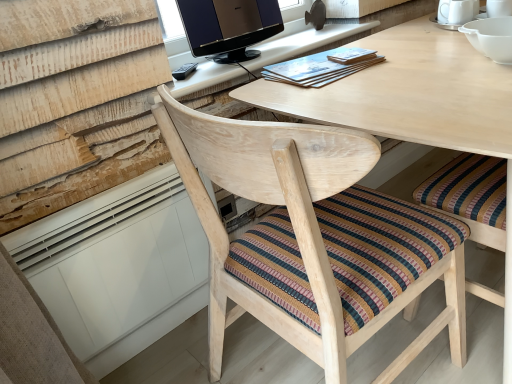
Question: Is natural wood chair at center smaller than matte wooden book at upper center, the 1th book when ordered from left to right?

Choices:
 (A) no
 (B) yes

Answer: (A)

Question: Does natural wood chair at center come behind matte wooden book at upper center, the 1th book when ordered from left to right?

Choices:
 (A) yes
 (B) no

Answer: (B)

Question: Is natural wood chair at center positioned before matte wooden book at upper center, the 2th book in the right-to-left sequence?

Choices:
 (A) no
 (B) yes

Answer: (B)

Question: From the image's perspective, would you say natural wood chair at center is shown under matte wooden book at upper center, the 2th book in the right-to-left sequence?

Choices:
 (A) yes
 (B) no

Answer: (A)

Question: Can matte wooden book at upper center, the 2th book in the right-to-left sequence, be found inside natural wood chair at center?

Choices:
 (A) yes
 (B) no

Answer: (B)

Question: Considering their positions, is light wood computer desk at upper center located in front of or behind matte brown book at upper center, the 2th book from the left?

Choices:
 (A) front
 (B) behind

Answer: (A)

Question: In terms of size, does light wood computer desk at upper center appear bigger or smaller than matte brown book at upper center, the 2th book from the left?

Choices:
 (A) small
 (B) big

Answer: (B)

Question: From the image's perspective, relative to matte brown book at upper center, the 2th book from the left, is light wood computer desk at upper center above or below?

Choices:
 (A) above
 (B) below

Answer: (A)

Question: Based on their positions, is light wood computer desk at upper center located to the left or right of matte brown book at upper center, the first book positioned from the right?

Choices:
 (A) left
 (B) right

Answer: (A)

Question: Considering the positions of natural wood chair at center and matte brown book at upper center, the 2th book from the left, in the image, is natural wood chair at center bigger or smaller than matte brown book at upper center, the 2th book from the left,?

Choices:
 (A) small
 (B) big

Answer: (B)

Question: Considering the positions of point (194, 119) and point (343, 48), is point (194, 119) closer or farther from the camera than point (343, 48)?

Choices:
 (A) farther
 (B) closer

Answer: (B)

Question: From the image's perspective, is natural wood chair at center above or below matte brown book at upper center, the 2th book from the left?

Choices:
 (A) above
 (B) below

Answer: (B)

Question: From a real-world perspective, is natural wood chair at center physically located above or below matte brown book at upper center, the 2th book from the left?

Choices:
 (A) below
 (B) above

Answer: (A)

Question: Would you say matte brown book at upper center, the first book positioned from the right, is to the left or to the right of light wood computer desk at upper center in the picture?

Choices:
 (A) right
 (B) left

Answer: (A)

Question: Relative to light wood computer desk at upper center, is matte brown book at upper center, the first book positioned from the right, in front or behind?

Choices:
 (A) front
 (B) behind

Answer: (B)